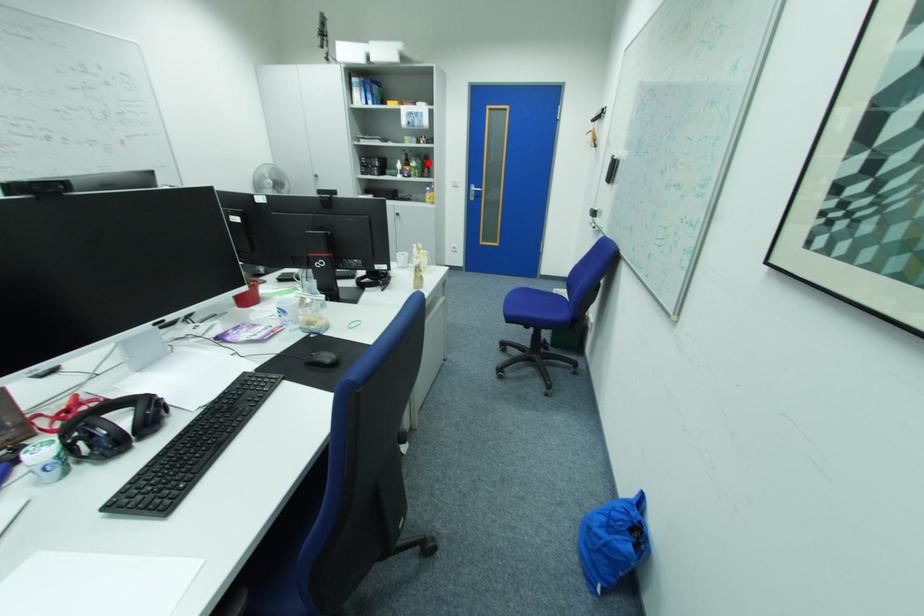
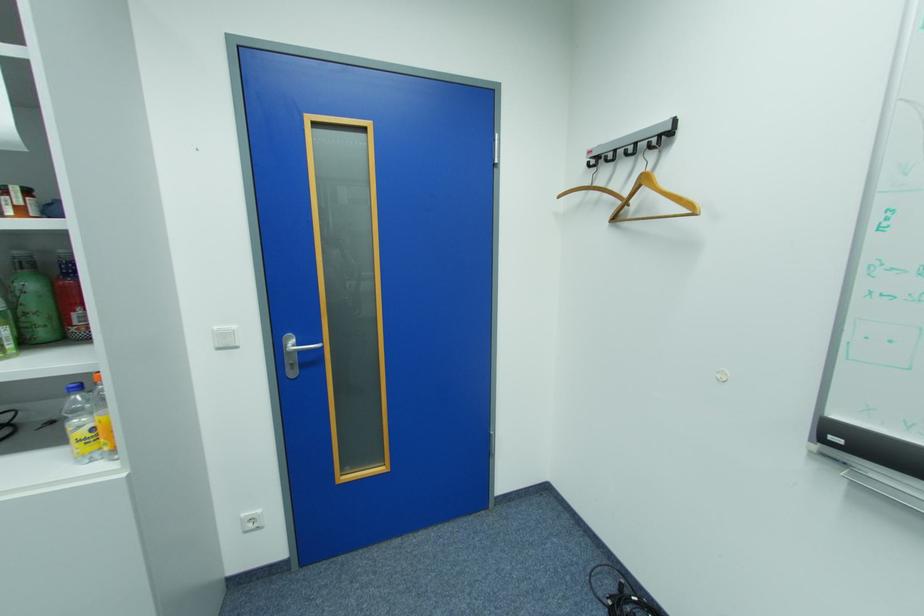
Question: I am providing you with two images of the same scene from different viewpoints. In image1, a red point is highlighted. Considering the same 3D point in image2, which of the following is correct?

Choices:
 (A) It is closer
 (B) It is farther

Answer: (B)